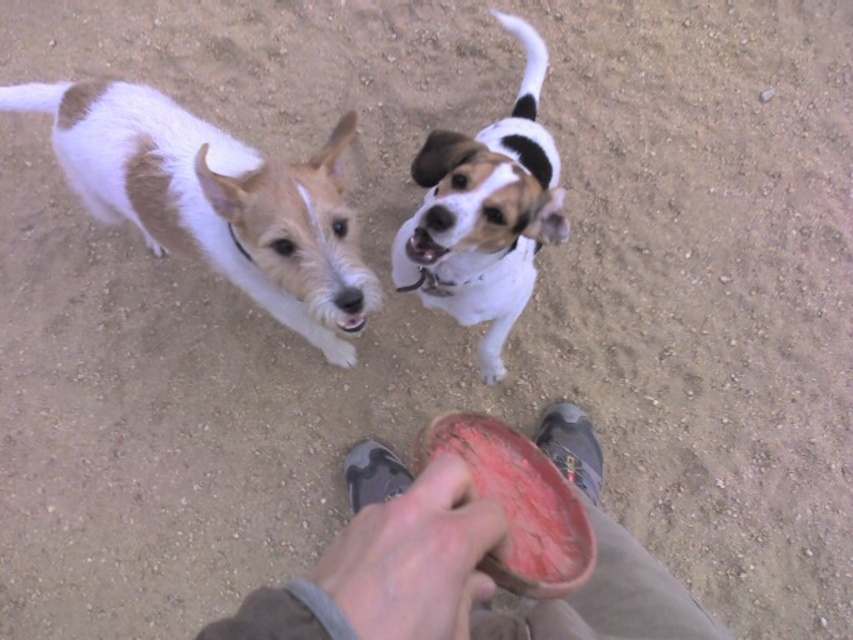
You are a dog trainer observing the scene. You notice a white fur dog at upper center and a smooth red frisbee at center. Which object is taller?

The white fur dog at upper center is much taller than the smooth red frisbee at center.

You are a dog owner trying to decide which toy to throw first. You see the brown and white fur at upper left and the smooth red frisbee at center. Which toy is closer to the ground?

The smooth red frisbee at center is closer to the ground because the brown and white fur at upper left is positioned over it, meaning it is above the frisbee.